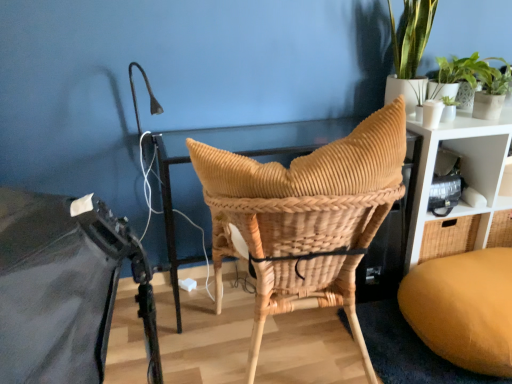
Question: Is natural woven chair at center not inside woven rattan basket at center?

Choices:
 (A) no
 (B) yes

Answer: (B)

Question: Is natural woven chair at center touching woven rattan basket at center?

Choices:
 (A) yes
 (B) no

Answer: (A)

Question: Can woven rattan basket at center be found inside natural woven chair at center?

Choices:
 (A) no
 (B) yes

Answer: (B)

Question: From a real-world perspective, is natural woven chair at center under woven rattan basket at center?

Choices:
 (A) yes
 (B) no

Answer: (A)

Question: Considering the relative positions of natural woven chair at center and woven rattan basket at center in the image provided, is natural woven chair at center to the left of woven rattan basket at center from the viewer's perspective?

Choices:
 (A) yes
 (B) no

Answer: (A)

Question: From a real-world perspective, is natural woven chair at center over woven rattan basket at center?

Choices:
 (A) yes
 (B) no

Answer: (B)

Question: Is white matte shelf at right, the second shelf in the bottom-to-top sequence, further to the viewer compared to white woven shelf at upper right, the 1th shelf when ordered from bottom to top?

Choices:
 (A) no
 (B) yes

Answer: (B)

Question: Can you confirm if white matte shelf at right, the first shelf viewed from the top, is bigger than white woven shelf at upper right, the 1th shelf when ordered from bottom to top?

Choices:
 (A) yes
 (B) no

Answer: (B)

Question: Is white matte shelf at right, the first shelf viewed from the top, thinner than white woven shelf at upper right, marked as the second shelf in a top-to-bottom arrangement?

Choices:
 (A) yes
 (B) no

Answer: (B)

Question: From the image's perspective, does white matte shelf at right, the second shelf in the bottom-to-top sequence, appear lower than white woven shelf at upper right, marked as the second shelf in a top-to-bottom arrangement?

Choices:
 (A) no
 (B) yes

Answer: (A)

Question: Is white woven shelf at upper right, the 1th shelf when ordered from bottom to top, a part of white matte shelf at right, the second shelf in the bottom-to-top sequence?

Choices:
 (A) no
 (B) yes

Answer: (A)

Question: Is white matte shelf at right, the second shelf in the bottom-to-top sequence, smaller than white woven shelf at upper right, marked as the second shelf in a top-to-bottom arrangement?

Choices:
 (A) no
 (B) yes

Answer: (B)

Question: Considering the relative sizes of white matte shelf at right, the first shelf viewed from the top, and natural woven chair at center in the image provided, is white matte shelf at right, the first shelf viewed from the top, taller than natural woven chair at center?

Choices:
 (A) yes
 (B) no

Answer: (B)